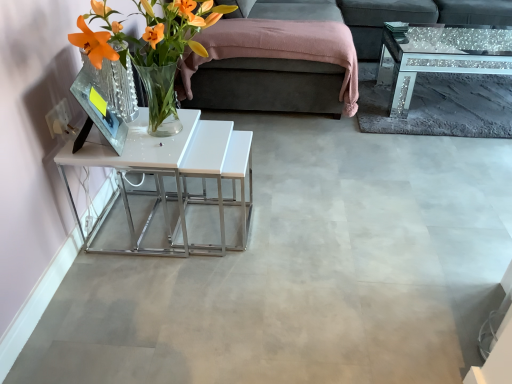
At what (x,y) coordinates should I click in order to perform the action: click on vacant space in front of white glossy table at left. Please return your answer as a coordinate pair (x, y). Image resolution: width=512 pixels, height=384 pixels. Looking at the image, I should click on (156, 302).